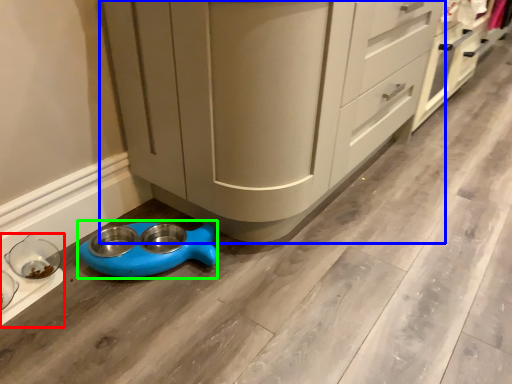
Question: Which object is positioned farthest from appliance (highlighted by a red box)? Select from cabinetry (highlighted by a blue box) and appliance (highlighted by a green box).

Choices:
 (A) cabinetry
 (B) appliance

Answer: (A)